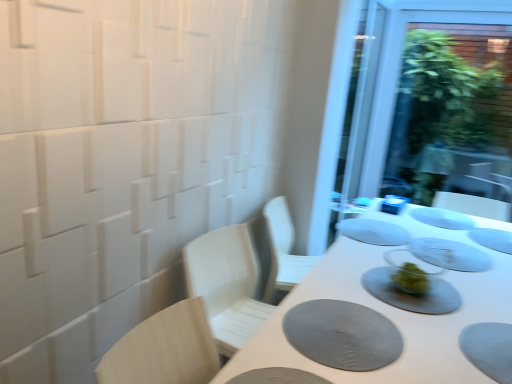
Where is `vacant space situated on the left part of clear glass plate at center, which is the 2th tableware from front to back`? vacant space situated on the left part of clear glass plate at center, which is the 2th tableware from front to back is located at coordinates (376, 247).